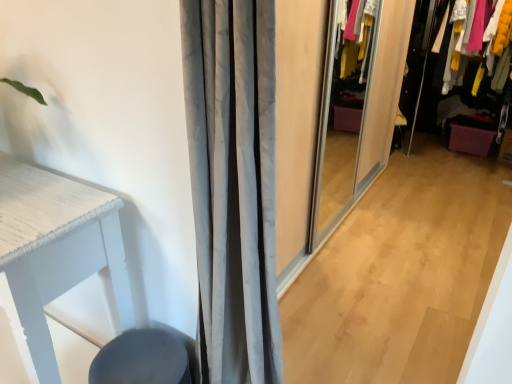
Question: From a real-world perspective, is matte black swivel chair at lower left positioned above or below velvet purple drawer at right?

Choices:
 (A) above
 (B) below

Answer: (B)

Question: Looking at their shapes, would you say matte black swivel chair at lower left is wider or thinner than velvet purple drawer at right?

Choices:
 (A) thin
 (B) wide

Answer: (A)

Question: Is matte black swivel chair at lower left spatially inside velvet purple drawer at right, or outside of it?

Choices:
 (A) outside
 (B) inside

Answer: (A)

Question: Does point (459, 79) appear closer or farther from the camera than point (134, 342)?

Choices:
 (A) farther
 (B) closer

Answer: (A)

Question: In the image, is velvet purple drawer at right positioned in front of or behind matte black swivel chair at lower left?

Choices:
 (A) behind
 (B) front

Answer: (A)

Question: Looking at their shapes, would you say velvet purple drawer at right is wider or thinner than matte black swivel chair at lower left?

Choices:
 (A) thin
 (B) wide

Answer: (B)

Question: Is velvet purple drawer at right bigger or smaller than matte black swivel chair at lower left?

Choices:
 (A) small
 (B) big

Answer: (B)